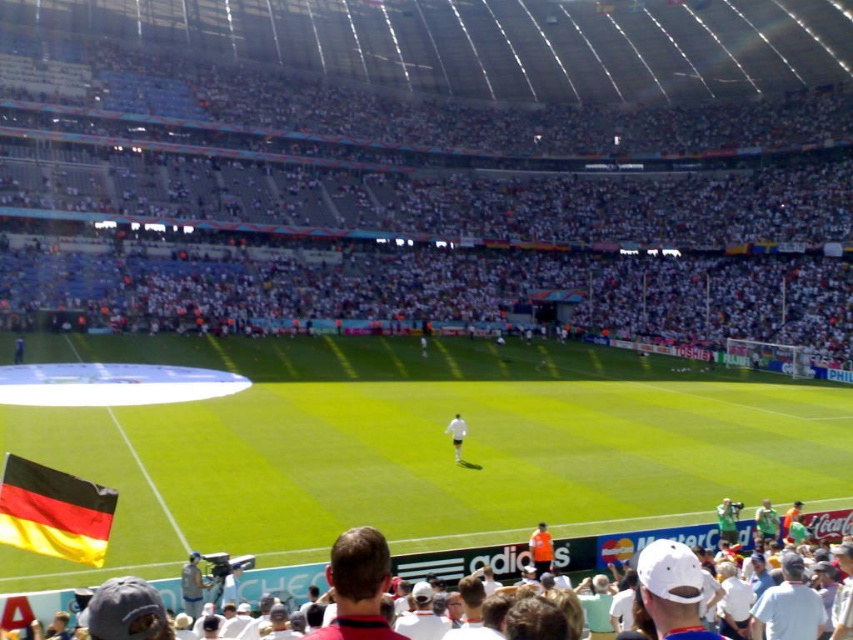
Question: Among these points, which one is nearest to the camera?

Choices:
 (A) (454, 420)
 (B) (260, 134)

Answer: (A)

Question: Which point is closer to the camera?

Choices:
 (A) black and yellow fabric flag at lower left
 (B) green grass football field at center
 (C) white matte shirt at center
 (D) white matte soccer player at center

Answer: (A)

Question: Is green grass football field at center smaller than white matte shirt at center?

Choices:
 (A) no
 (B) yes

Answer: (A)

Question: Does white fabric crowd at upper center have a smaller size compared to white matte soccer player at center?

Choices:
 (A) yes
 (B) no

Answer: (B)

Question: Observing the image, what is the correct spatial positioning of white matte shirt at center in reference to orange jersey at center?

Choices:
 (A) above
 (B) below

Answer: (B)

Question: Based on their relative distances, which object is farther from the orange jersey at center?

Choices:
 (A) white fabric crowd at upper center
 (B) white matte soccer player at center
 (C) green grass football field at center

Answer: (A)